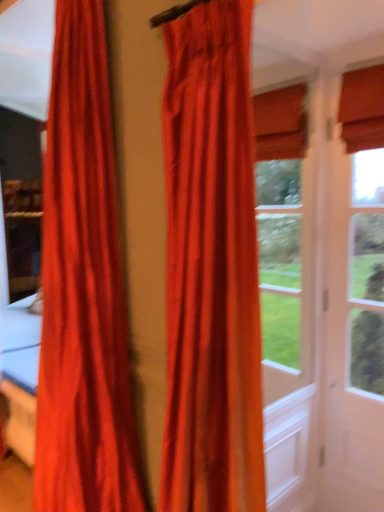
Question: From the image's perspective, is satin orange curtain at left, which is the 2th curtain in right-to-left order, located above or below satin-like red curtain at center, the first curtain positioned from the right?

Choices:
 (A) above
 (B) below

Answer: (A)

Question: Does point (39, 506) appear closer or farther from the camera than point (195, 33)?

Choices:
 (A) closer
 (B) farther

Answer: (B)

Question: Which object is the farthest from the matte white screen door at right?

Choices:
 (A) satin-like red curtain at center, the first curtain positioned from the right
 (B) satin orange curtain at left, marked as the first curtain in a left-to-right arrangement

Answer: (B)

Question: Which object is the farthest from the satin-like red curtain at center, the first curtain positioned from the right?

Choices:
 (A) matte white screen door at right
 (B) satin orange curtain at left, marked as the first curtain in a left-to-right arrangement

Answer: (A)